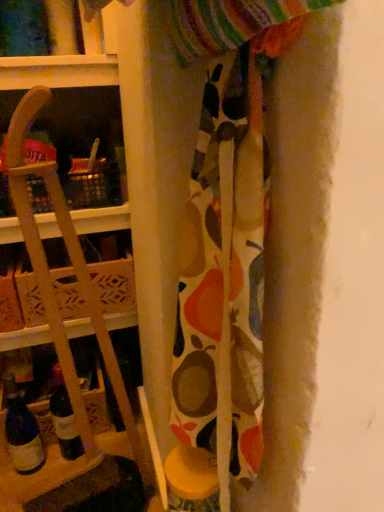
Question: From a real-world perspective, is translucent glass wine bottle at lower left on top of wooden at left?

Choices:
 (A) yes
 (B) no

Answer: (B)

Question: Is translucent glass wine bottle at lower left turned away from wooden at left?

Choices:
 (A) no
 (B) yes

Answer: (A)

Question: Is the depth of translucent glass wine bottle at lower left less than that of wooden at left?

Choices:
 (A) no
 (B) yes

Answer: (A)

Question: Is translucent glass wine bottle at lower left far from wooden at left?

Choices:
 (A) yes
 (B) no

Answer: (B)

Question: From the image's perspective, is translucent glass wine bottle at lower left under wooden at left?

Choices:
 (A) yes
 (B) no

Answer: (A)

Question: Is translucent glass wine bottle at lower left thinner than wooden at left?

Choices:
 (A) yes
 (B) no

Answer: (A)

Question: Would you consider patterned fabric at center to be distant from wooden crate at left?

Choices:
 (A) no
 (B) yes

Answer: (A)

Question: Considering the relative sizes of patterned fabric at center and wooden crate at left in the image provided, is patterned fabric at center thinner than wooden crate at left?

Choices:
 (A) yes
 (B) no

Answer: (A)

Question: Considering the relative positions of patterned fabric at center and wooden crate at left in the image provided, is patterned fabric at center to the right of wooden crate at left from the viewer's perspective?

Choices:
 (A) no
 (B) yes

Answer: (B)

Question: Considering the relative positions of patterned fabric at center and wooden crate at left in the image provided, is patterned fabric at center to the left of wooden crate at left from the viewer's perspective?

Choices:
 (A) yes
 (B) no

Answer: (B)

Question: Is patterned fabric at center positioned before wooden crate at left?

Choices:
 (A) no
 (B) yes

Answer: (B)

Question: Can you confirm if patterned fabric at center is taller than wooden crate at left?

Choices:
 (A) no
 (B) yes

Answer: (B)

Question: From a real-world perspective, is wooden at left beneath patterned fabric at center?

Choices:
 (A) yes
 (B) no

Answer: (A)